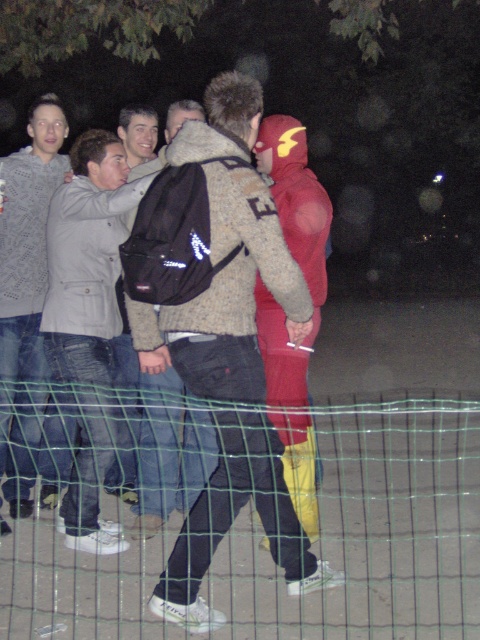
Which is below, knitted sweater at center or black fabric backpack at center?

black fabric backpack at center is lower down.

Who is more forward, (176, 330) or (167, 408)?

Point (176, 330) is more forward.

Locate an element on the screen. knitted sweater at center is located at coordinates (218, 333).

Which of these two, green mesh fence at lower center or jeans at left, stands shorter?

green mesh fence at lower center

Image resolution: width=480 pixels, height=640 pixels. What do you see at coordinates (372, 531) in the screenshot? I see `green mesh fence at lower center` at bounding box center [372, 531].

Image resolution: width=480 pixels, height=640 pixels. Describe the element at coordinates (372, 531) in the screenshot. I see `green mesh fence at lower center` at that location.

Locate an element on the screen. Image resolution: width=480 pixels, height=640 pixels. green mesh fence at lower center is located at coordinates (372, 531).

Image resolution: width=480 pixels, height=640 pixels. What do you see at coordinates (86, 259) in the screenshot? I see `light gray fabric jacket at center` at bounding box center [86, 259].

Is light gray fabric jacket at center taller than red matte costume at center?

In fact, light gray fabric jacket at center may be shorter than red matte costume at center.

Who is more forward, (59, 368) or (314, 266)?

Positioned in front is point (59, 368).

This screenshot has height=640, width=480. I want to click on light gray fabric jacket at center, so click(x=86, y=259).